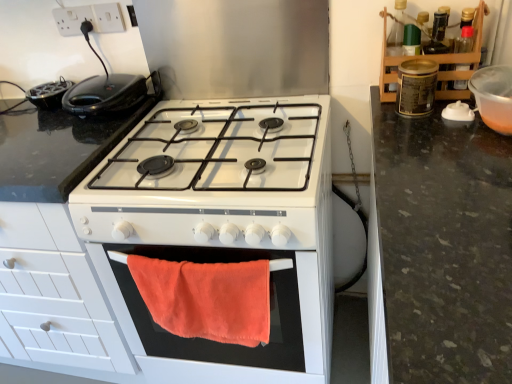
Where is `vacant space underneath black plastic sandwich maker at upper left (from a real-world perspective)`? The width and height of the screenshot is (512, 384). vacant space underneath black plastic sandwich maker at upper left (from a real-world perspective) is located at coordinates (109, 115).